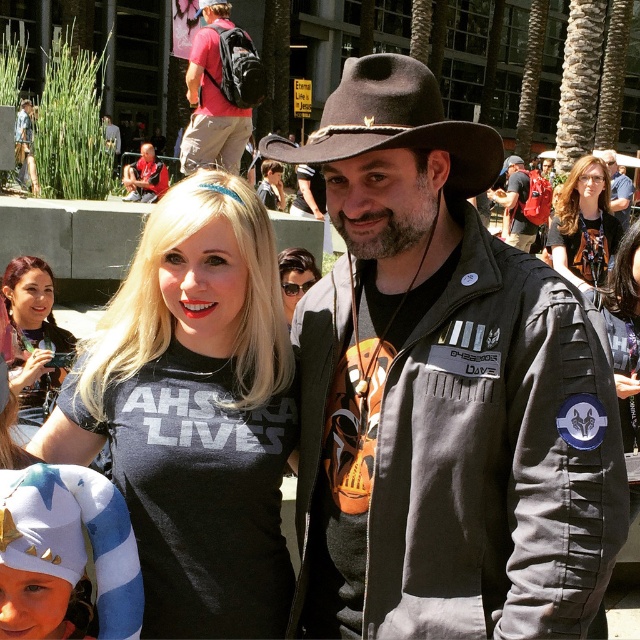
Question: Which point is farther to the camera?

Choices:
 (A) (285, 248)
 (B) (150, 163)
 (C) (52, 356)
 (D) (513, 241)

Answer: (B)

Question: Based on their relative distances, which object is nearer to the dark gray fabric jacket at center?

Choices:
 (A) matte black cowboy hat at upper right
 (B) blue and white knit hat at lower left
 (C) black felt fedora at center

Answer: (A)

Question: Can you confirm if black felt fedora at center is positioned below dark gray fabric jacket at center?

Choices:
 (A) no
 (B) yes

Answer: (B)

Question: Does matte black sunglasses at center have a lesser width compared to matte black cowboy hat at upper right?

Choices:
 (A) no
 (B) yes

Answer: (B)

Question: Which object is closer to the camera taking this photo?

Choices:
 (A) dark gray fabric jacket at center
 (B) blue and white knit hat at lower left
 (C) matte black cowboy hat at center
 (D) matte black cowboy hat at upper right

Answer: (B)

Question: Is matte red t-shirt at upper center positioned before matte black shirt at center?

Choices:
 (A) no
 (B) yes

Answer: (B)